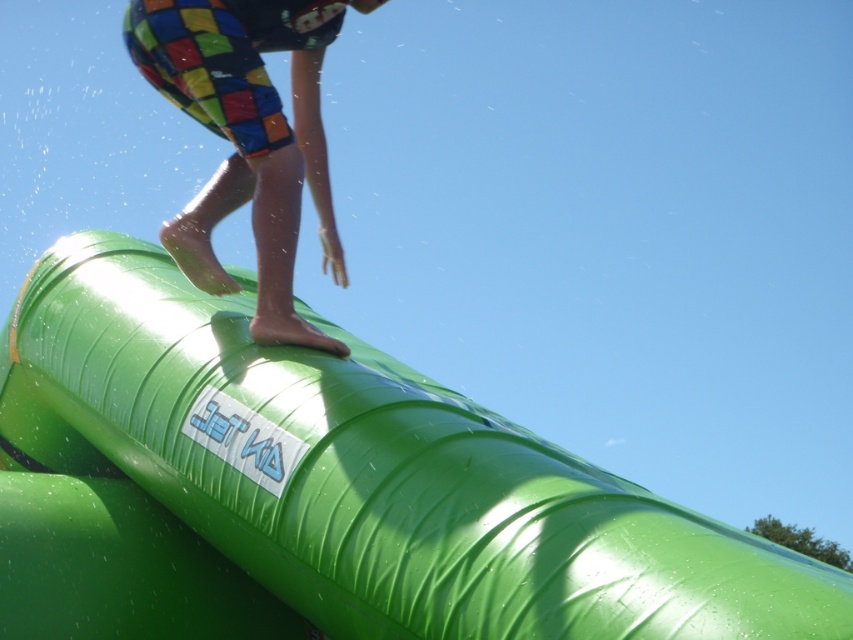
You are a drone operator trying to capture the best aerial shot of the green rubber slide at upper center. You have a marker at point coordinates (322, 490). Is this point on the green rubber slide at upper center?

Yes, the point coordinates (322, 490) is on the green rubber slide at upper center.

You are a photographer trying to capture the child on the slide. Since the green rubber slide at upper center and the multicolored shorts at upper center are in the scene, which one should you focus on to ensure the child is centered in your photo?

The multicolored shorts at upper center should be focused on because the green rubber slide at upper center is below it, meaning the shorts are higher up and closer to the center of the child.